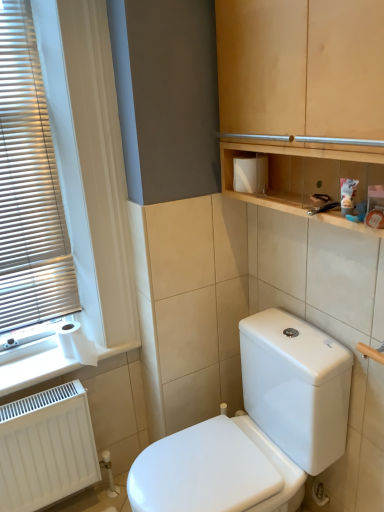
Question: Considering the relative positions of white matte toilet paper at lower left and white paper at lower left in the image provided, is white matte toilet paper at lower left behind white paper at lower left?

Choices:
 (A) yes
 (B) no

Answer: (A)

Question: Does white matte toilet paper at lower left appear on the left side of white paper at lower left?

Choices:
 (A) yes
 (B) no

Answer: (B)

Question: From a real-world perspective, is white matte toilet paper at lower left physically above white paper at lower left?

Choices:
 (A) yes
 (B) no

Answer: (A)

Question: Is white matte toilet paper at lower left beside white paper at lower left?

Choices:
 (A) no
 (B) yes

Answer: (B)

Question: From the image's perspective, would you say white matte toilet paper at lower left is positioned over white paper at lower left?

Choices:
 (A) no
 (B) yes

Answer: (B)

Question: Can you confirm if white matte toilet paper at lower left is shorter than white paper at lower left?

Choices:
 (A) no
 (B) yes

Answer: (A)

Question: Does white matte toilet paper at lower left turn towards white matte radiator at lower left?

Choices:
 (A) no
 (B) yes

Answer: (A)

Question: Does white matte toilet paper at lower left lie in front of white matte radiator at lower left?

Choices:
 (A) no
 (B) yes

Answer: (A)

Question: From a real-world perspective, does white matte toilet paper at lower left sit lower than white matte radiator at lower left?

Choices:
 (A) yes
 (B) no

Answer: (B)

Question: Considering the relative positions of white matte toilet paper at lower left and white matte radiator at lower left in the image provided, is white matte toilet paper at lower left to the left of white matte radiator at lower left from the viewer's perspective?

Choices:
 (A) no
 (B) yes

Answer: (A)

Question: Is white matte toilet paper at lower left placed right next to white matte radiator at lower left?

Choices:
 (A) yes
 (B) no

Answer: (B)

Question: Is white matte toilet paper at lower left positioned with its back to white matte radiator at lower left?

Choices:
 (A) yes
 (B) no

Answer: (B)

Question: From a real-world perspective, is white glossy toilet at center physically above white matte toilet paper at lower left?

Choices:
 (A) no
 (B) yes

Answer: (A)